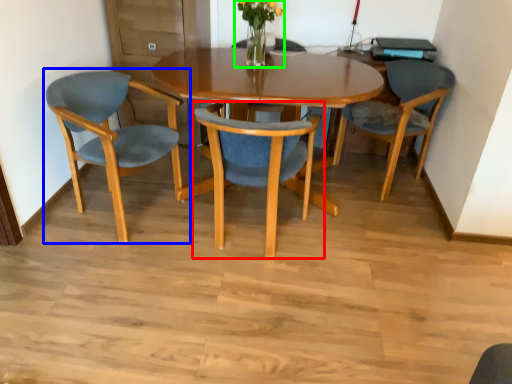
Question: Based on their relative distances, which object is farther from chair (highlighted by a red box)? Choose from chair (highlighted by a blue box) and floral arrangement (highlighted by a green box).

Choices:
 (A) chair
 (B) floral arrangement

Answer: (B)